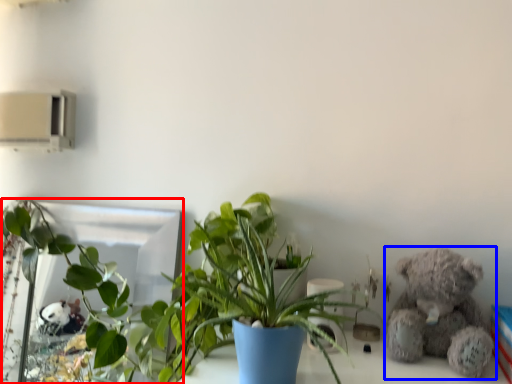
Question: Which of the following is the closest to the observer, mirror (highlighted by a red box) or teddy bear (highlighted by a blue box)?

Choices:
 (A) mirror
 (B) teddy bear

Answer: (B)